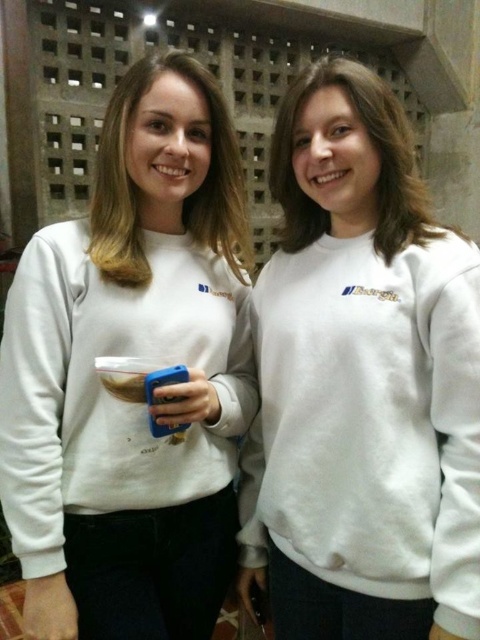
Is point (367, 512) farther from viewer compared to point (22, 460)?

That is False.

Can you confirm if white fleece sweatshirt at center is shorter than white matte sweatshirt at center?

Indeed, white fleece sweatshirt at center has a lesser height compared to white matte sweatshirt at center.

Which is behind, point (324, 573) or point (107, 323)?

Point (324, 573)

The width and height of the screenshot is (480, 640). I want to click on white fleece sweatshirt at center, so click(x=361, y=381).